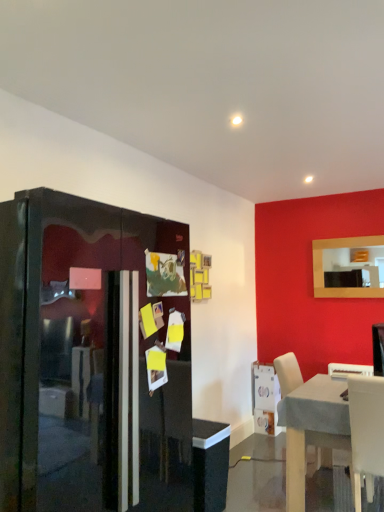
Question: Is light wood table at lower right at the left side of white plastic chair at lower right, which appears as the first chair when viewed from the back?

Choices:
 (A) yes
 (B) no

Answer: (A)

Question: Considering the relative sizes of light wood table at lower right and white plastic chair at lower right, which appears as the first chair when viewed from the back, in the image provided, is light wood table at lower right wider than white plastic chair at lower right, which appears as the first chair when viewed from the back,?

Choices:
 (A) yes
 (B) no

Answer: (A)

Question: Is light wood table at lower right taller than white plastic chair at lower right, which appears as the second chair when ordered from the bottom?

Choices:
 (A) no
 (B) yes

Answer: (B)

Question: Are light wood table at lower right and white plastic chair at lower right, marked as the 1th chair in a top-to-bottom arrangement, making contact?

Choices:
 (A) no
 (B) yes

Answer: (A)

Question: Is white plastic chair at lower right, which appears as the first chair when viewed from the back, surrounded by light wood table at lower right?

Choices:
 (A) yes
 (B) no

Answer: (B)

Question: From the image's perspective, is light wood table at lower right on white plastic chair at lower right, marked as the 1th chair in a top-to-bottom arrangement?

Choices:
 (A) yes
 (B) no

Answer: (B)

Question: Can you confirm if white plastic chair at lower right, which is the second chair from front to back, is wider than glossy black fridge at left?

Choices:
 (A) no
 (B) yes

Answer: (A)

Question: Is white plastic chair at lower right, marked as the 1th chair in a top-to-bottom arrangement, oriented towards glossy black fridge at left?

Choices:
 (A) yes
 (B) no

Answer: (B)

Question: Is white plastic chair at lower right, which appears as the first chair when viewed from the back, in front of glossy black fridge at left?

Choices:
 (A) yes
 (B) no

Answer: (B)

Question: Can glossy black fridge at left be found inside white plastic chair at lower right, which appears as the second chair when ordered from the bottom?

Choices:
 (A) no
 (B) yes

Answer: (A)

Question: Can you confirm if white plastic chair at lower right, marked as the 1th chair in a top-to-bottom arrangement, is shorter than glossy black fridge at left?

Choices:
 (A) no
 (B) yes

Answer: (B)

Question: Is white plastic chair at lower right, which appears as the first chair when viewed from the back, not inside glossy black fridge at left?

Choices:
 (A) no
 (B) yes

Answer: (B)

Question: Is light wood table at lower right positioned far away from glossy black fridge at left?

Choices:
 (A) no
 (B) yes

Answer: (B)